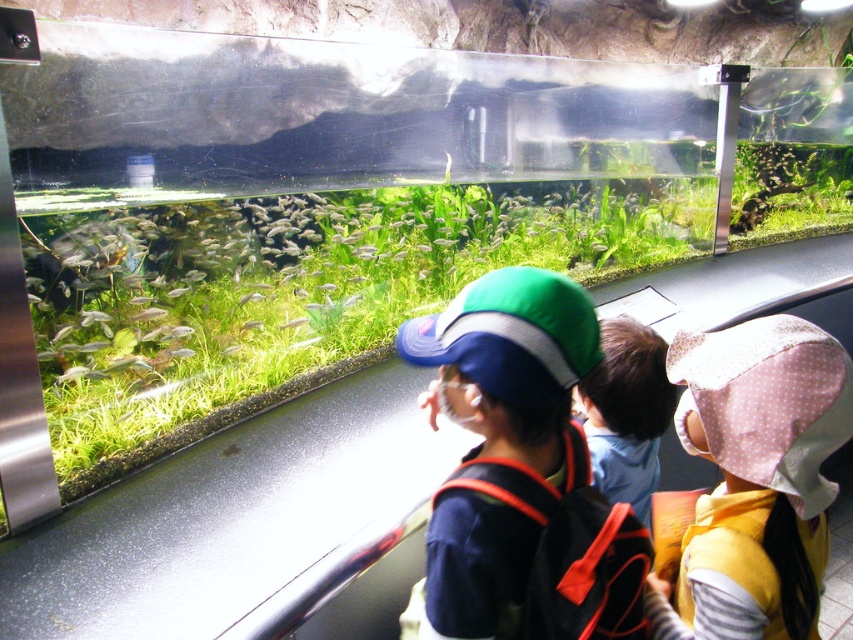
Question: Is matte blue cap at center positioned before translucent glass fish at center?

Choices:
 (A) yes
 (B) no

Answer: (A)

Question: Is pink dotted fabric hat at upper right below blue fabric cap at center?

Choices:
 (A) yes
 (B) no

Answer: (A)

Question: Which point is closer to the camera?

Choices:
 (A) (643, 401)
 (B) (299, 316)
 (C) (595, 346)

Answer: (C)

Question: Is blue fabric cap at center in front of translucent glass fish at center?

Choices:
 (A) no
 (B) yes

Answer: (B)

Question: Which point is closer to the camera taking this photo?

Choices:
 (A) (607, 360)
 (B) (496, 600)
 (C) (300, 323)
 (D) (689, 620)

Answer: (B)

Question: Estimate the real-world distances between objects in this image. Which object is farther from the matte blue cap at center?

Choices:
 (A) blue fabric cap at center
 (B) translucent glass fish at center

Answer: (B)